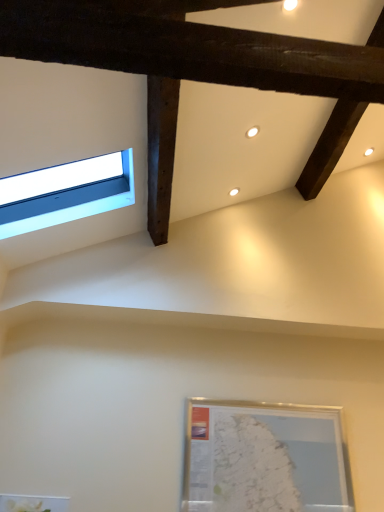
Question: In terms of width, does blue glass window at upper left look wider or thinner when compared to silver metallic picture frame at lower right?

Choices:
 (A) thin
 (B) wide

Answer: (B)

Question: From the image's perspective, is blue glass window at upper left above or below silver metallic picture frame at lower right?

Choices:
 (A) below
 (B) above

Answer: (B)

Question: Is blue glass window at upper left inside the boundaries of silver metallic picture frame at lower right, or outside?

Choices:
 (A) outside
 (B) inside

Answer: (A)

Question: Is point (327, 496) positioned closer to the camera than point (38, 214)?

Choices:
 (A) closer
 (B) farther

Answer: (A)

Question: In terms of width, does silver metallic picture frame at lower right look wider or thinner when compared to blue glass window at upper left?

Choices:
 (A) thin
 (B) wide

Answer: (A)

Question: Relative to blue glass window at upper left, is silver metallic picture frame at lower right in front or behind?

Choices:
 (A) front
 (B) behind

Answer: (B)

Question: Is silver metallic picture frame at lower right taller or shorter than blue glass window at upper left?

Choices:
 (A) tall
 (B) short

Answer: (A)